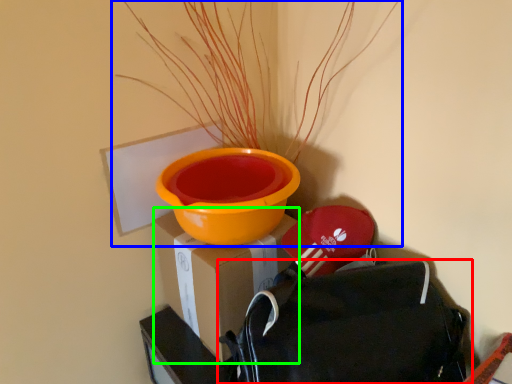
Question: Which is farther away from backpack (highlighted by a red box)? houseplant (highlighted by a blue box) or cardboard box (highlighted by a green box)?

Choices:
 (A) houseplant
 (B) cardboard box

Answer: (A)